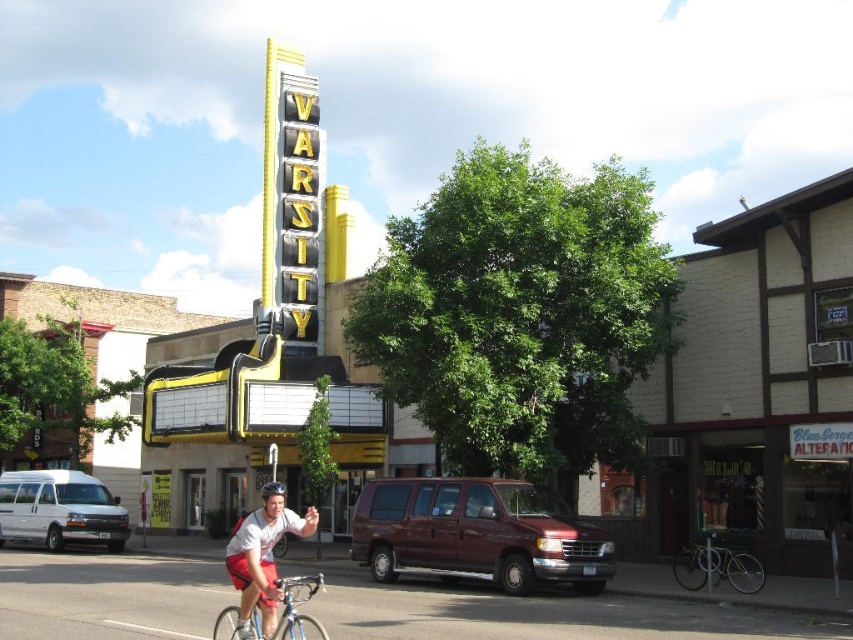
You are a pedestrian standing on the sidewalk in front of the theater marquee. You see a white van at left and a matte white helmet at center. Which object is closer to your right side?

The matte white helmet at center is closer to your right side because it is positioned to the right of the white van at left.

You are standing in front of the theater and want to take a photo of both the Varsity marquee and the Blue Serge Al storefront. Which point, point 1 at coordinates (518, 564) or point 2 at (79, 518), should you focus on to ensure both the Varsity marquee and the Blue Serge Al storefront are in clear view?

You should focus on point 1 at coordinates (518, 564) because it is closer to the camera than point 2 at (79, 518), ensuring both the Varsity marquee and the Blue Serge Al storefront are in clear view.

You are a pedestrian standing on the sidewalk in front of the theater marquee. You notice two vans parked on the street. Which van is closer to you, the maroon matte van at center or the white van at left?

The maroon matte van at center is closer to you because it is positioned nearer to the theater marquee compared to the white van at left.